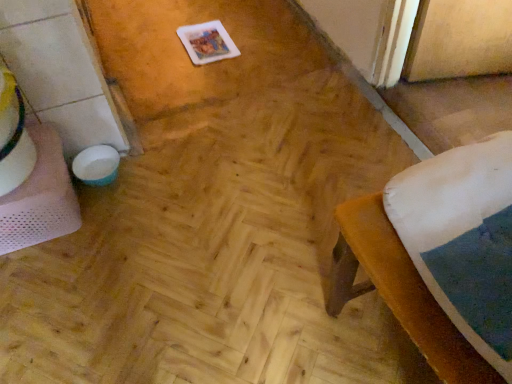
Question: From the image's perspective, is white mesh table at left below brown fabric stool at lower right?

Choices:
 (A) no
 (B) yes

Answer: (A)

Question: Does white mesh table at left have a greater height compared to brown fabric stool at lower right?

Choices:
 (A) no
 (B) yes

Answer: (A)

Question: Is white mesh table at left closer to the viewer compared to brown fabric stool at lower right?

Choices:
 (A) no
 (B) yes

Answer: (A)

Question: Considering the relative positions of white mesh table at left and brown fabric stool at lower right in the image provided, is white mesh table at left behind brown fabric stool at lower right?

Choices:
 (A) yes
 (B) no

Answer: (A)

Question: From the image's perspective, is white mesh table at left over brown fabric stool at lower right?

Choices:
 (A) yes
 (B) no

Answer: (A)

Question: Can you confirm if white mesh table at left is positioned to the right of brown fabric stool at lower right?

Choices:
 (A) no
 (B) yes

Answer: (A)

Question: Is brown fabric stool at lower right facing away from white mesh table at left?

Choices:
 (A) no
 (B) yes

Answer: (A)

Question: Is brown fabric stool at lower right outside white mesh table at left?

Choices:
 (A) yes
 (B) no

Answer: (A)

Question: Considering the relative positions of brown fabric stool at lower right and white mesh table at left in the image provided, is brown fabric stool at lower right behind white mesh table at left?

Choices:
 (A) no
 (B) yes

Answer: (A)

Question: Is the surface of brown fabric stool at lower right in direct contact with white mesh table at left?

Choices:
 (A) yes
 (B) no

Answer: (B)

Question: Can you confirm if brown fabric stool at lower right is positioned to the left of white mesh table at left?

Choices:
 (A) yes
 (B) no

Answer: (B)

Question: Does brown fabric stool at lower right have a greater width compared to white mesh table at left?

Choices:
 (A) no
 (B) yes

Answer: (B)

Question: From the image's perspective, relative to white mesh table at left, is brown fabric stool at lower right above or below?

Choices:
 (A) below
 (B) above

Answer: (A)